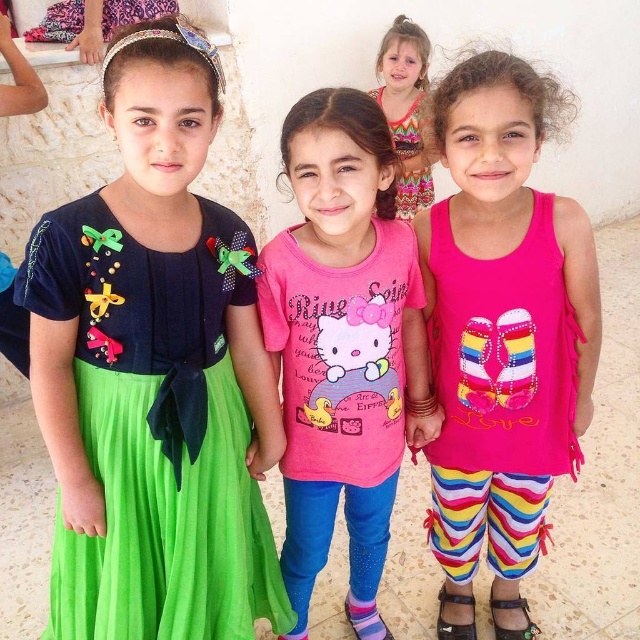
Question: Considering the relative positions of green fabric dress at left and pink matte hello kitty shirt at center in the image provided, where is green fabric dress at left located with respect to pink matte hello kitty shirt at center?

Choices:
 (A) right
 (B) left

Answer: (B)

Question: Which object is positioned closest to the brown leather sandal at lower right?

Choices:
 (A) green fabric dress at left
 (B) pink fabric tank top at center

Answer: (B)

Question: Which object is closer to the camera taking this photo?

Choices:
 (A) green fabric dress at left
 (B) pink matte hello kitty shirt at center
 (C) pink fabric tank top at center
 (D) printed cotton dress at upper center

Answer: (A)

Question: Is green fabric dress at left positioned in front of printed cotton dress at upper center?

Choices:
 (A) no
 (B) yes

Answer: (B)

Question: Which object is closer to the camera taking this photo?

Choices:
 (A) pink matte hello kitty shirt at center
 (B) printed cotton dress at upper center
 (C) green fabric dress at left

Answer: (C)

Question: Can you confirm if green fabric dress at left is positioned to the left of pink fabric tank top at center?

Choices:
 (A) yes
 (B) no

Answer: (A)